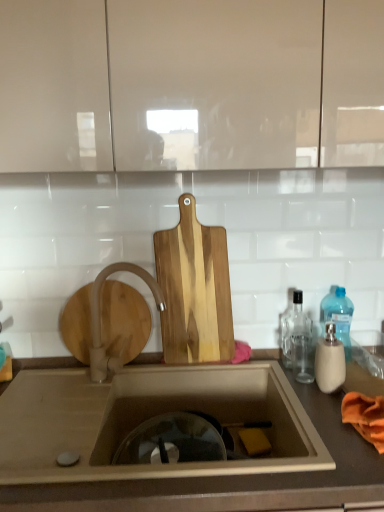
Locate an element on the screen. Image resolution: width=384 pixels, height=512 pixels. vacant area that is in front of white matte faucet at sink left is located at coordinates (85, 415).